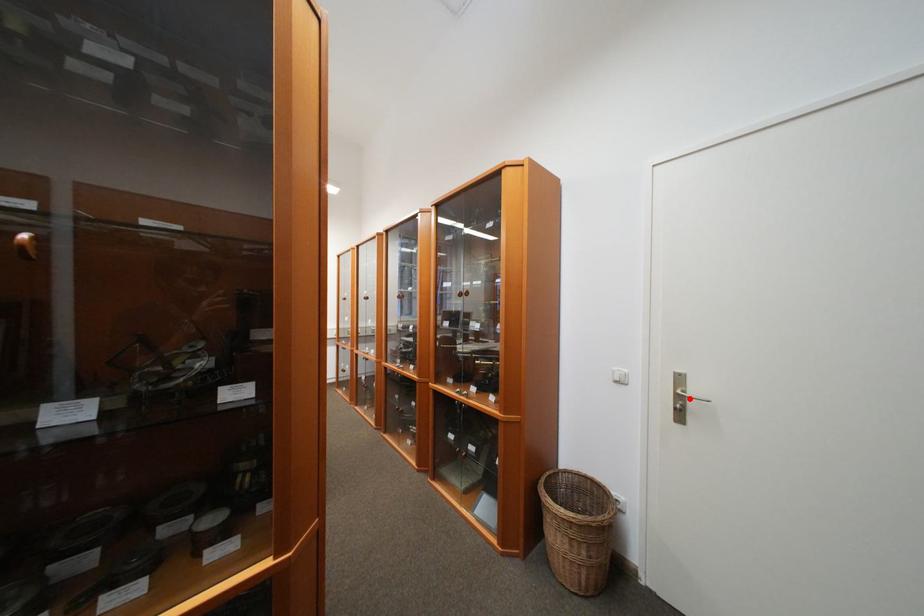
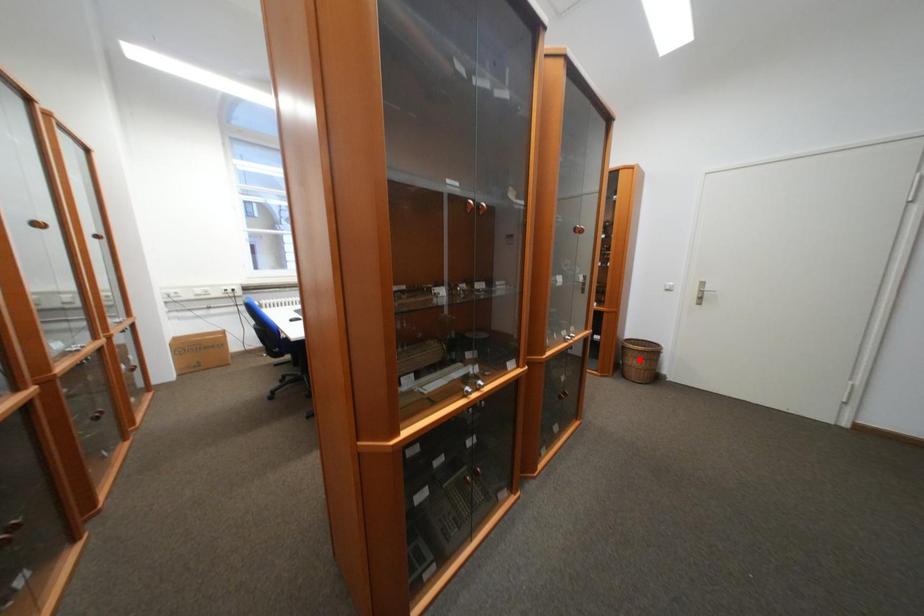
I am providing you with two images of the same scene from different viewpoints. A red point is marked on the first image and another point is marked on the second image. Is the marked point in image1 the same physical position as the marked point in image2?

No